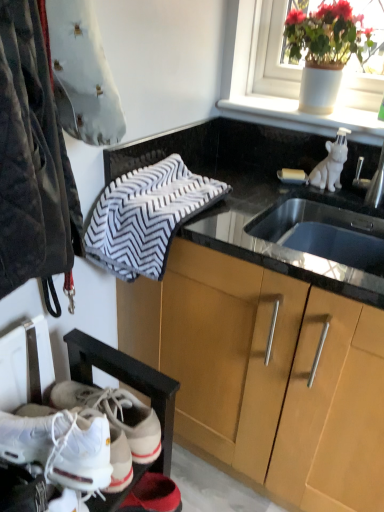
Identify the location of empty space that is ontop of white leather sneakers at lower left (from a real-world perspective). The image size is (384, 512). (35, 462).